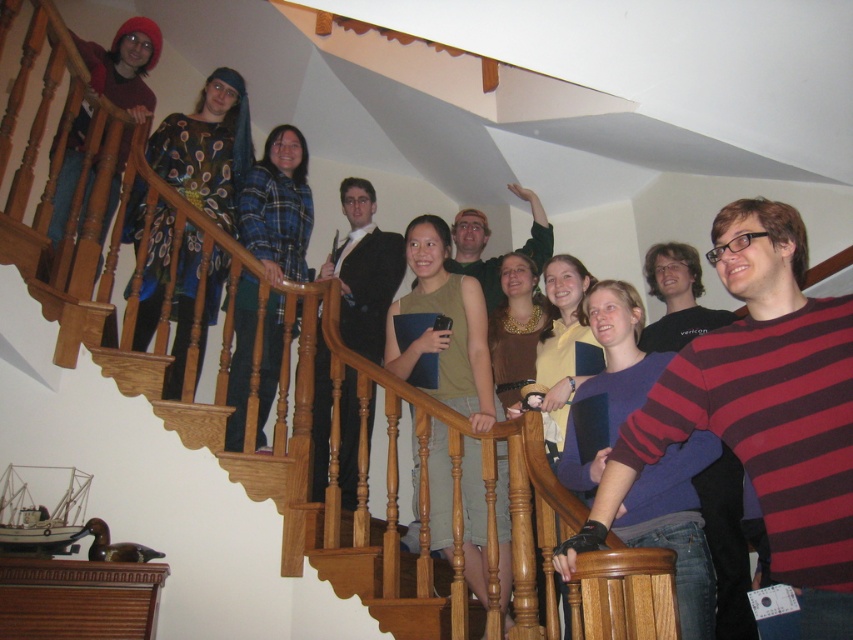
You are a photographer trying to capture a clear shot of both the purple cotton sweater at center and the black suit jacket at center. Since you can only focus on one at a time, which one should you focus on to ensure the other is still in the background?

The purple cotton sweater at center is positioned under the black suit jacket at center. Therefore, if you focus on the black suit jacket at center, the purple cotton sweater at center will naturally appear in the background, making it the better choice for your shot.

You are taking a photo of the group on the staircase and need to focus on the matte green tank top at center. According to the coordinates provided, where exactly should you aim your camera?

The matte green tank top at center is located at point coordinates (445, 330), so aim your camera precisely at those coordinates to focus on it.